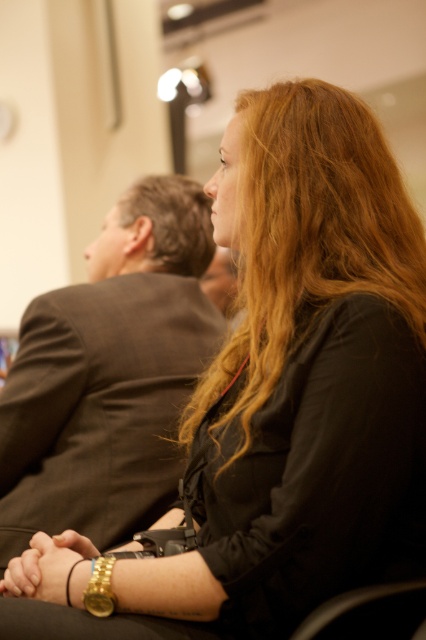
You are a photographer setting up for a group photo. You notice the dark brown suit at center and the gold metallic bracelet at lower center. Which object is positioned more to the left in the frame?

The dark brown suit at center is positioned more to the left in the frame than the gold metallic bracelet at lower center.

You are standing at point (242, 248) in a conference room. You want to take a photo of the scene using a camera that has a focal length of 50mm. If the camera is placed at its current position, will the entire scene be captured in the photo?

The point (242, 248) and the camera are 4.03 feet apart. With a 50mm focal length, the camera can capture the scene within its field of view since the distance is within the typical focal length range for such a setup.

You are an artist trying to sketch the scene. You notice the blonde hair at center and the gold metallic bracelet at center. Which object should you draw first if you want to follow the size from largest to smallest?

The blonde hair at center is bigger than the gold metallic bracelet at center, so you should draw the blonde hair at center first.